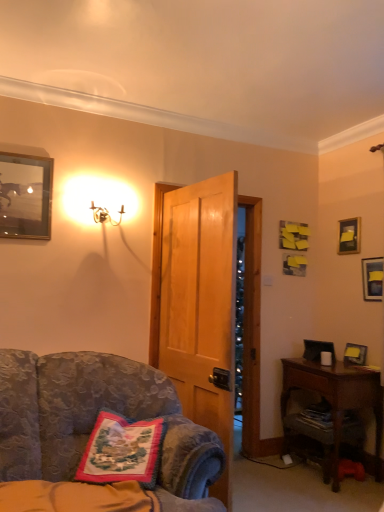
Question: Considering the relative sizes of wooden picture frame at right, acting as the second picture frame starting from the left, and velvet floral-patterned chair at center-left in the image provided, is wooden picture frame at right, acting as the second picture frame starting from the left, thinner than velvet floral-patterned chair at center-left?

Choices:
 (A) yes
 (B) no

Answer: (A)

Question: Does wooden picture frame at right, the 4th picture frame from the top, lie behind velvet floral-patterned chair at center-left?

Choices:
 (A) no
 (B) yes

Answer: (B)

Question: Is wooden picture frame at right, positioned as the second picture frame in back-to-front order, not close to velvet floral-patterned chair at center-left?

Choices:
 (A) no
 (B) yes

Answer: (B)

Question: Is wooden picture frame at right, the 4th picture frame from the top, taller than velvet floral-patterned chair at center-left?

Choices:
 (A) no
 (B) yes

Answer: (A)

Question: Is wooden picture frame at right, positioned as the second picture frame in back-to-front order, shorter than velvet floral-patterned chair at center-left?

Choices:
 (A) yes
 (B) no

Answer: (A)

Question: Is velvet floral-patterned chair at center-left at the back of wooden picture frame at right, which is counted as the 3th picture frame, starting from the right?

Choices:
 (A) no
 (B) yes

Answer: (A)

Question: Considering the relative sizes of gold metallic sconce at upper left and matte black picture frame at upper right, which is counted as the third picture frame, starting from the back, in the image provided, is gold metallic sconce at upper left smaller than matte black picture frame at upper right, which is counted as the third picture frame, starting from the back,?

Choices:
 (A) yes
 (B) no

Answer: (B)

Question: Does gold metallic sconce at upper left have a lesser height compared to matte black picture frame at upper right, the second picture frame when ordered from bottom to top?

Choices:
 (A) no
 (B) yes

Answer: (B)

Question: From the image's perspective, is gold metallic sconce at upper left under matte black picture frame at upper right, which is counted as the third picture frame, starting from the back?

Choices:
 (A) yes
 (B) no

Answer: (B)

Question: From a real-world perspective, does gold metallic sconce at upper left sit lower than matte black picture frame at upper right, which is counted as the third picture frame, starting from the back?

Choices:
 (A) no
 (B) yes

Answer: (A)

Question: Does gold metallic sconce at upper left have a larger size compared to matte black picture frame at upper right, the second picture frame when ordered from bottom to top?

Choices:
 (A) yes
 (B) no

Answer: (A)

Question: Are gold metallic sconce at upper left and matte black picture frame at upper right, arranged as the third picture frame when viewed from the top, making contact?

Choices:
 (A) no
 (B) yes

Answer: (A)

Question: Is metallic silver picture frame at upper left, the first picture frame in the front-to-back sequence, completely or partially outside of matte black picture frame at upper right, positioned as the 1th picture frame in back-to-front order?

Choices:
 (A) no
 (B) yes

Answer: (B)